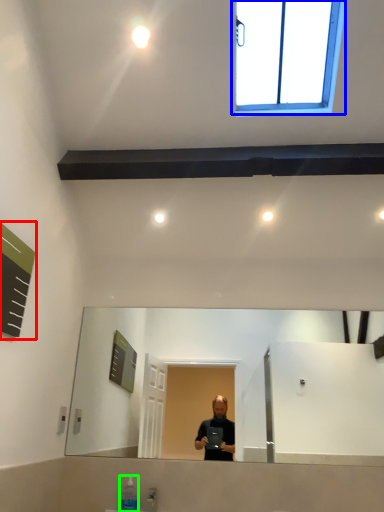
Question: Based on their relative distances, which object is farther from bulletin board (highlighted by a red box)? Choose from window (highlighted by a blue box) and toiletry (highlighted by a green box).

Choices:
 (A) window
 (B) toiletry

Answer: (A)